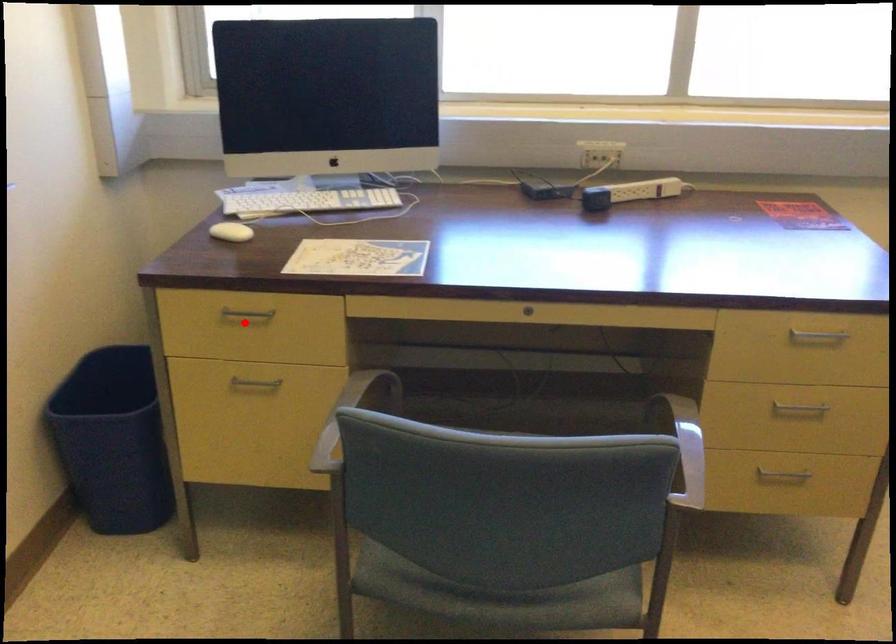
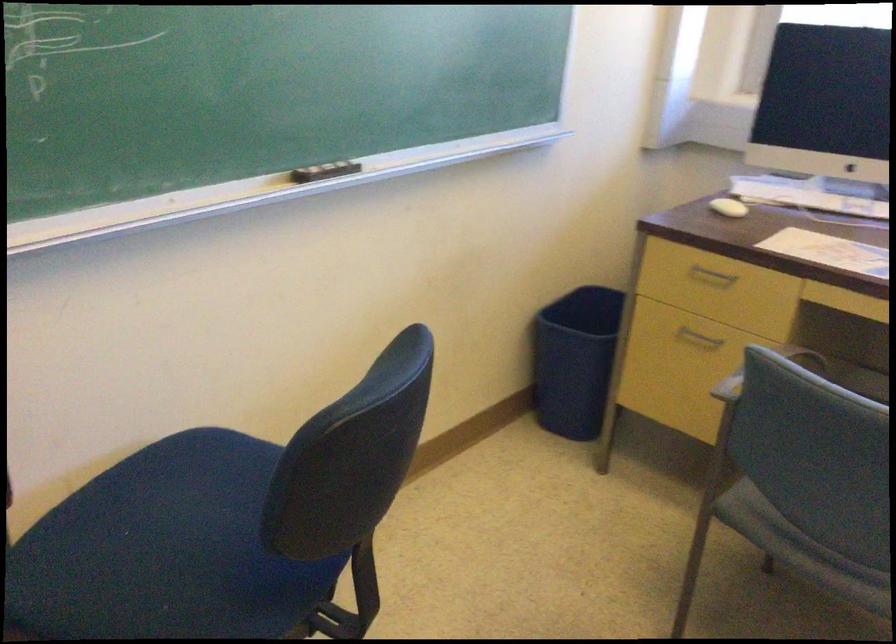
Find the pixel in the second image that matches the highlighted location in the first image.

(711, 277)